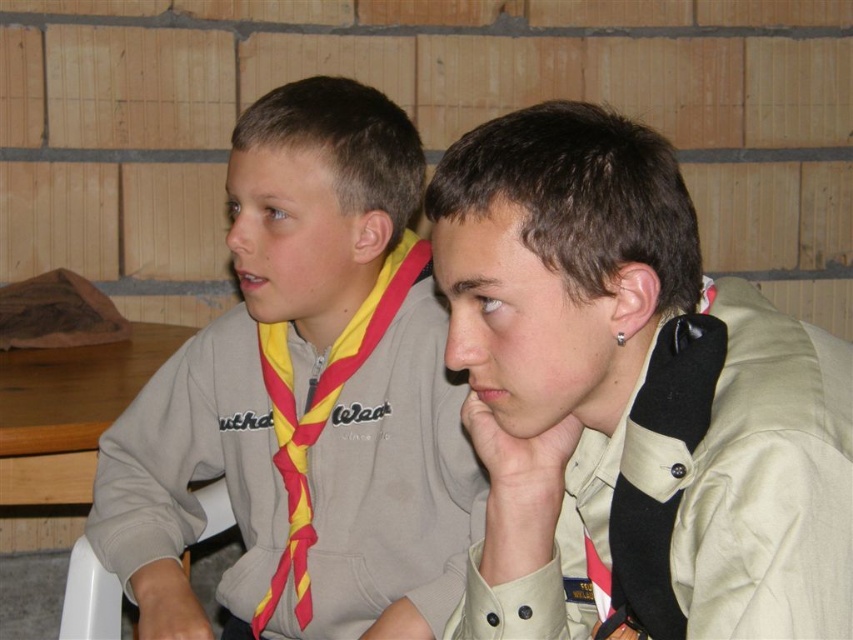
Question: Which object is positioned farthest from the tan uniform shirt at center?

Choices:
 (A) yellow/red striped neckerchief at center
 (B) gray fleece sweatshirt at left

Answer: (A)

Question: Which point appears closest to the camera in this image?

Choices:
 (A) (376, 412)
 (B) (326, 296)

Answer: (B)

Question: Is tan uniform shirt at center further to camera compared to gray fleece sweatshirt at left?

Choices:
 (A) yes
 (B) no

Answer: (B)

Question: Which point is closer to the camera taking this photo?

Choices:
 (A) (335, 278)
 (B) (184, 465)

Answer: (A)

Question: Is tan uniform shirt at center bigger than yellow/red striped neckerchief at center?

Choices:
 (A) no
 (B) yes

Answer: (B)

Question: Can you confirm if tan uniform shirt at center is positioned to the left of yellow/red striped neckerchief at center?

Choices:
 (A) no
 (B) yes

Answer: (A)